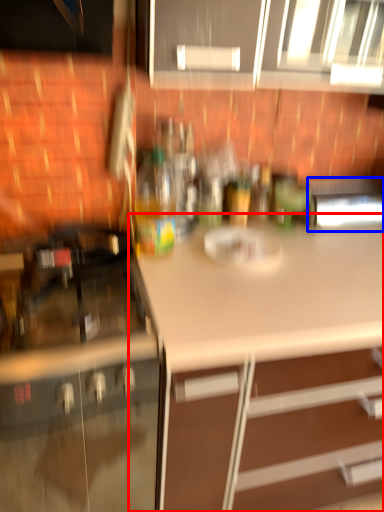
Question: Which object is closer to the camera taking this photo, countertop (highlighted by a red box) or appliance (highlighted by a blue box)?

Choices:
 (A) countertop
 (B) appliance

Answer: (A)